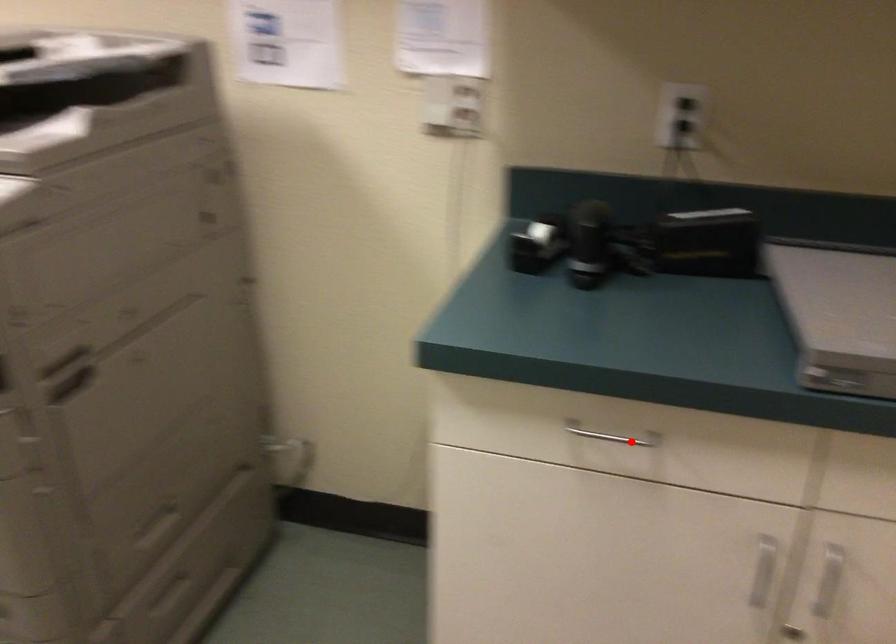
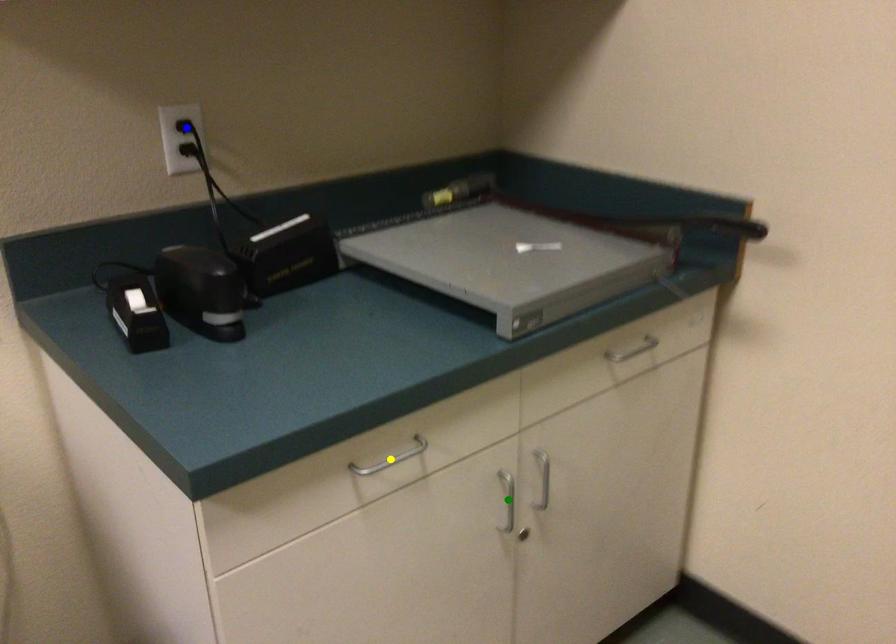
Question: I am providing you with two images of the same scene from different viewpoints. A red point is marked on the first image. You are given multiple points on the second image. Which mark in image 2 goes with the point in image 1?

Choices:
 (A) yellow point
 (B) blue point
 (C) green point

Answer: (A)